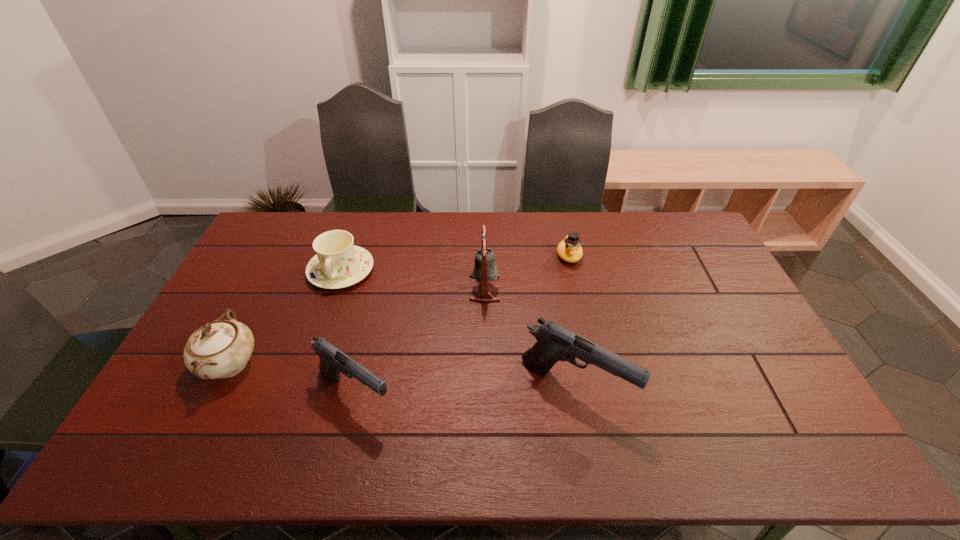
Image resolution: width=960 pixels, height=540 pixels. I want to click on blank region between the shorter chinaware and the duck, so click(455, 263).

Where is `vacant area that lies between the bell and the leftmost object`? vacant area that lies between the bell and the leftmost object is located at coordinates click(357, 326).

Identify the location of free space between the taller gun and the farther chinaware. The width and height of the screenshot is (960, 540). (458, 330).

The height and width of the screenshot is (540, 960). What are the coordinates of `free space between the left chinaware and the duck` in the screenshot? It's located at (399, 310).

Find the location of `the second closest object to the shorter chinaware`. the second closest object to the shorter chinaware is located at coordinates (333, 361).

The height and width of the screenshot is (540, 960). Find the location of `object that stands as the fifth closest to the shorter gun`. object that stands as the fifth closest to the shorter gun is located at coordinates (569, 249).

What are the coordinates of `free location that satisfies the following two spatial constraints: 1. on the handle side of the farther chinaware; 2. on the right side of the bell` in the screenshot? It's located at (335, 288).

Find the location of a particular element. This screenshot has height=540, width=960. free space that satisfies the following two spatial constraints: 1. on the front-facing side of the duck; 2. at the muzzle of the right gun is located at coordinates (599, 389).